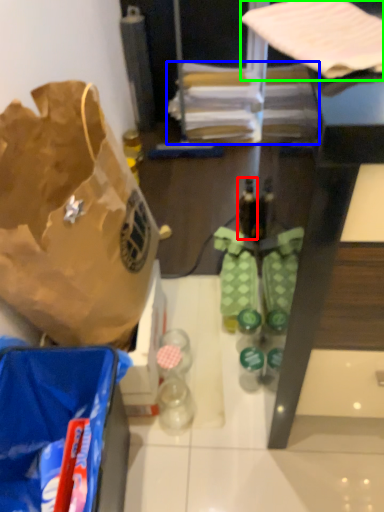
Question: Which object is positioned closest to bottle (highlighted by a red box)? Select from wrapping paper (highlighted by a blue box) and wrapping paper (highlighted by a green box).

Choices:
 (A) wrapping paper
 (B) wrapping paper

Answer: (A)